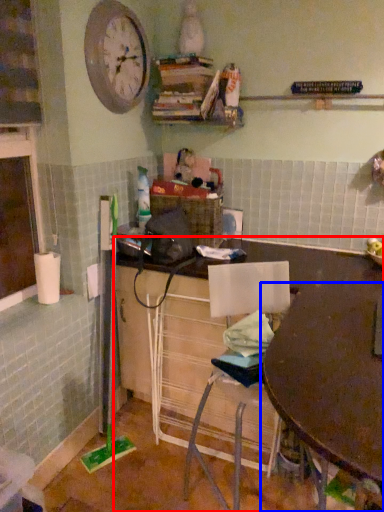
Question: Which object appears farthest to the camera in this image, desk (highlighted by a red box) or table (highlighted by a blue box)?

Choices:
 (A) desk
 (B) table

Answer: (A)